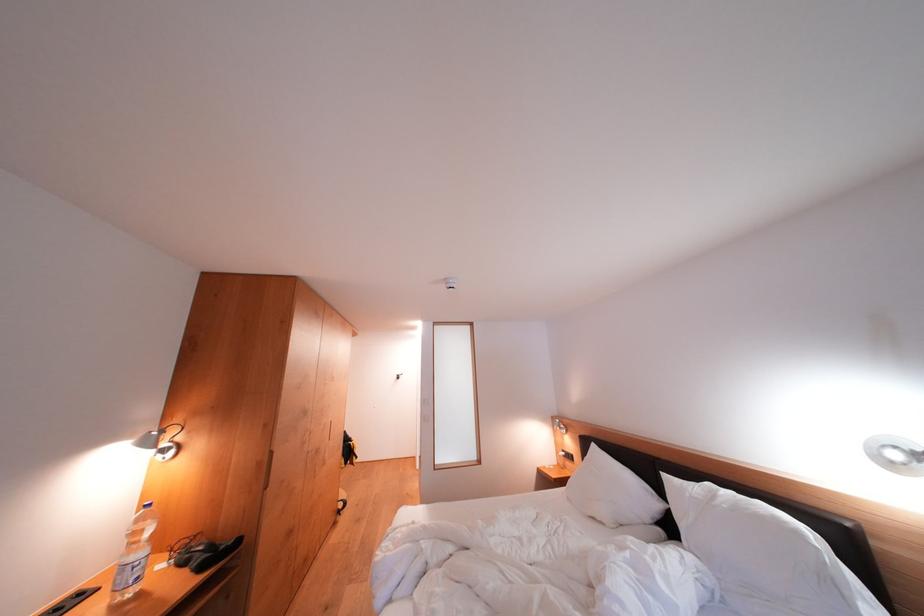
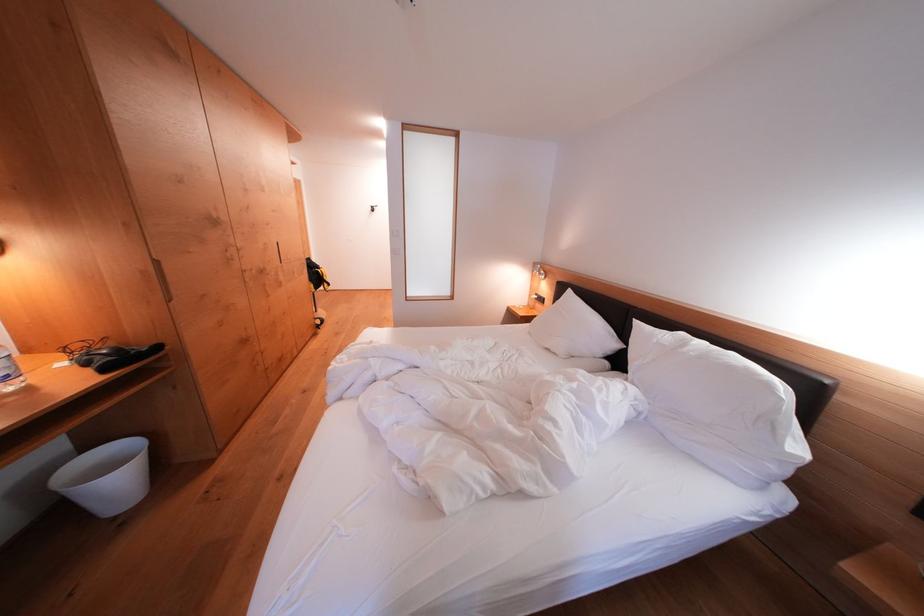
Locate, in the second image, the point that corresponds to pixel 144 582 in the first image.

(14, 381)